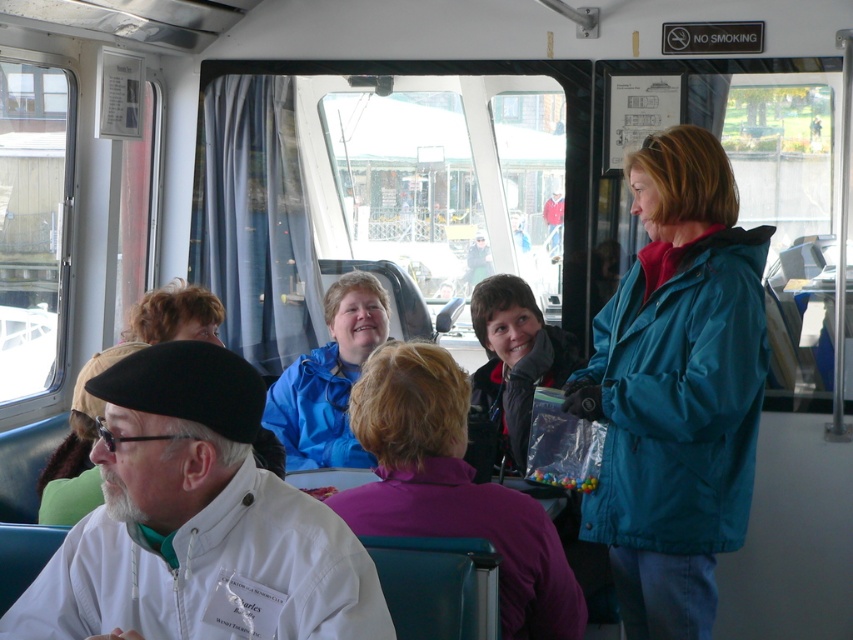
You are a passenger on the ferry and want to hand a document to the person wearing the purple fleece jacket at center. You are currently standing near the white matte coat at lower left. Can you directly hand the document without moving past any obstacles?

The white matte coat at lower left is closer to the viewer than the purple fleece jacket at center, so you would need to move past the white matte coat at lower left to reach the purple fleece jacket at center.

You are a passenger on the ferry and want to take a photo of both point (289, 586) and point (483, 500) in the cabin. Which point should you focus on first to ensure both are in clear view?

You should focus on point (289, 586) first since it is closer to the camera than point (483, 500), ensuring both points are in focus when using a camera with a fixed focal length.